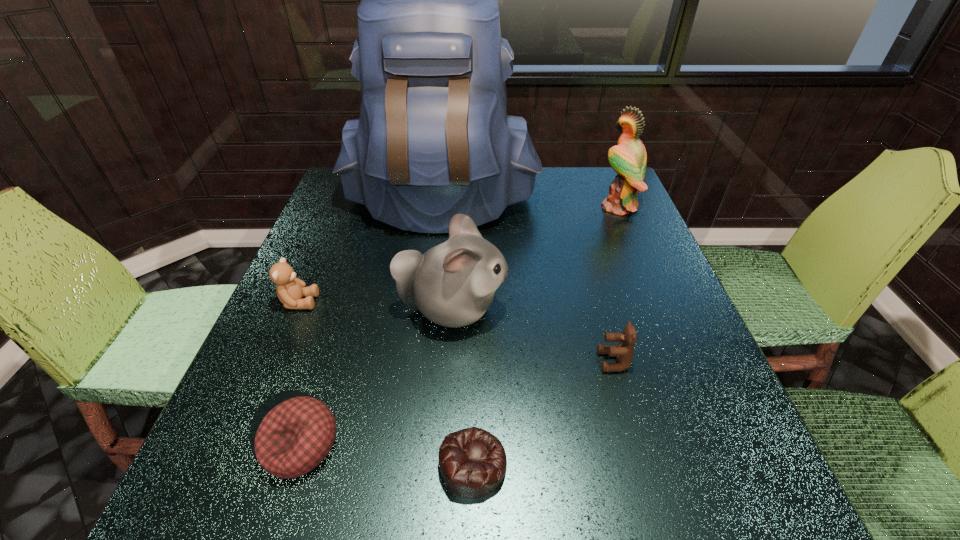
Locate an element on the screen. The image size is (960, 540). the shortest object is located at coordinates (472, 461).

Where is `vacant area situated 0.240m at the front pocket of the tallest object`? The width and height of the screenshot is (960, 540). vacant area situated 0.240m at the front pocket of the tallest object is located at coordinates (426, 309).

This screenshot has width=960, height=540. What are the coordinates of `vacant area situated 0.070m on the front-facing side of the rightmost object` in the screenshot? It's located at (574, 207).

What are the coordinates of `free spot located 0.110m on the front-facing side of the rightmost object` in the screenshot? It's located at (560, 207).

This screenshot has width=960, height=540. Identify the location of free location located 0.150m on the front-facing side of the rightmost object. (545, 207).

Find the location of a particular element. vacant region located 0.320m on the face of the third tallest object is located at coordinates (657, 310).

Where is `free space located on the face of the farther teddy bear`? Image resolution: width=960 pixels, height=540 pixels. free space located on the face of the farther teddy bear is located at coordinates (414, 302).

The width and height of the screenshot is (960, 540). What are the coordinates of `vacant space situated 0.240m on the face of the third nearest object` in the screenshot? It's located at pyautogui.click(x=473, y=361).

Where is `blank space located on the face of the third nearest object`? blank space located on the face of the third nearest object is located at coordinates (536, 361).

In order to click on free region located on the face of the third nearest object in this screenshot , I will do `click(447, 361)`.